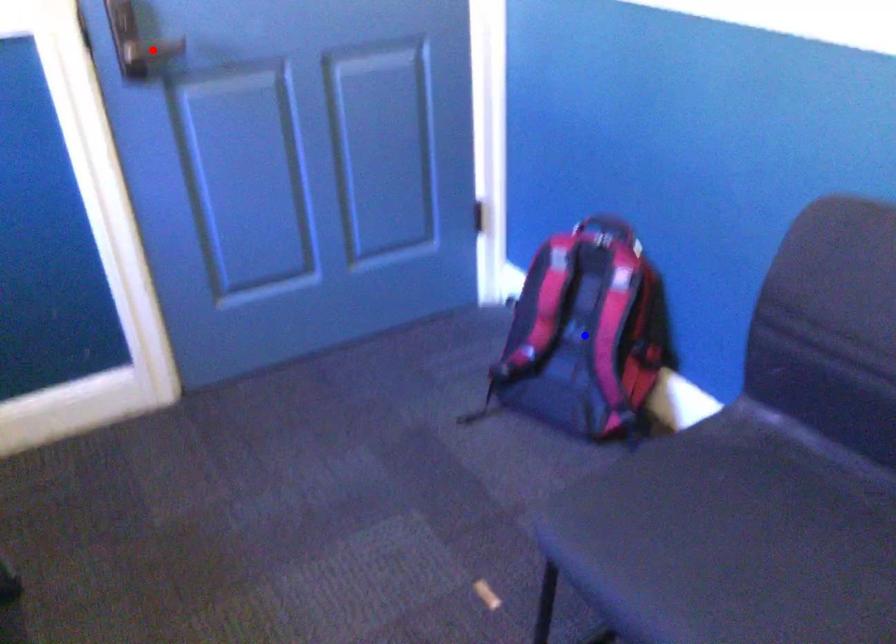
Question: In the image, two points are highlighted. Which point is nearer to the camera? Reply with the corresponding letter.

Choices:
 (A) blue point
 (B) red point

Answer: (B)